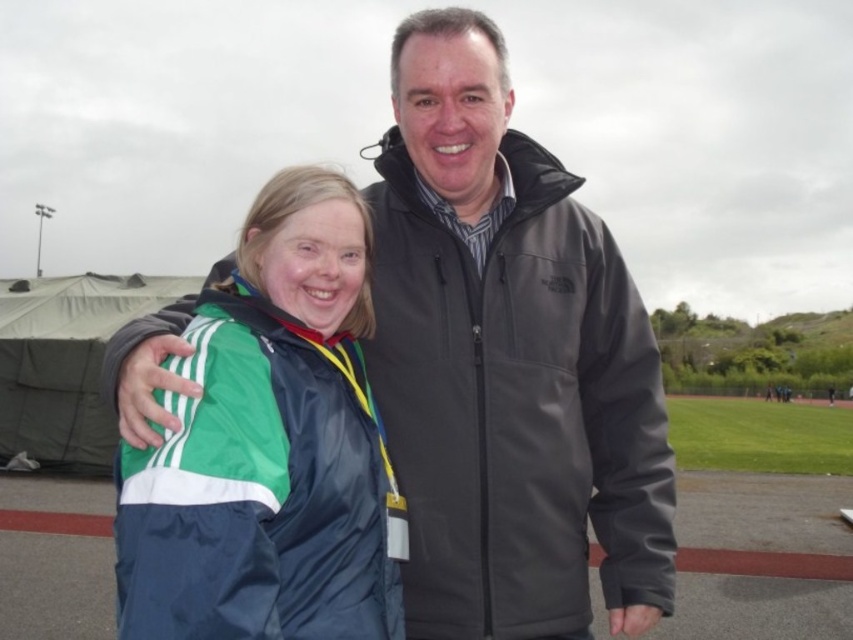
Which is above, dark gray softshell jacket at center or green fabric tent at left?

dark gray softshell jacket at center is higher up.

Who is positioned more to the right, dark gray softshell jacket at center or green fabric tent at left?

From the viewer's perspective, dark gray softshell jacket at center appears more on the right side.

Between point (582, 584) and point (84, 337), which one is positioned in front?

Positioned in front is point (582, 584).

This screenshot has width=853, height=640. I want to click on dark gray softshell jacket at center, so click(x=508, y=364).

Does green fabric jacket at center appear on the right side of green fabric tent at left?

Correct, you'll find green fabric jacket at center to the right of green fabric tent at left.

Which is more to the left, green fabric jacket at center or green fabric tent at left?

green fabric tent at left

Describe the element at coordinates (270, 445) in the screenshot. The image size is (853, 640). I see `green fabric jacket at center` at that location.

Where is `green fabric jacket at center`? Image resolution: width=853 pixels, height=640 pixels. green fabric jacket at center is located at coordinates (270, 445).

Which is below, dark gray softshell jacket at center or green fabric jacket at center?

green fabric jacket at center

Does point (436, 22) lie in front of point (283, 232)?

No.

This screenshot has width=853, height=640. Find the location of `dark gray softshell jacket at center`. dark gray softshell jacket at center is located at coordinates (508, 364).